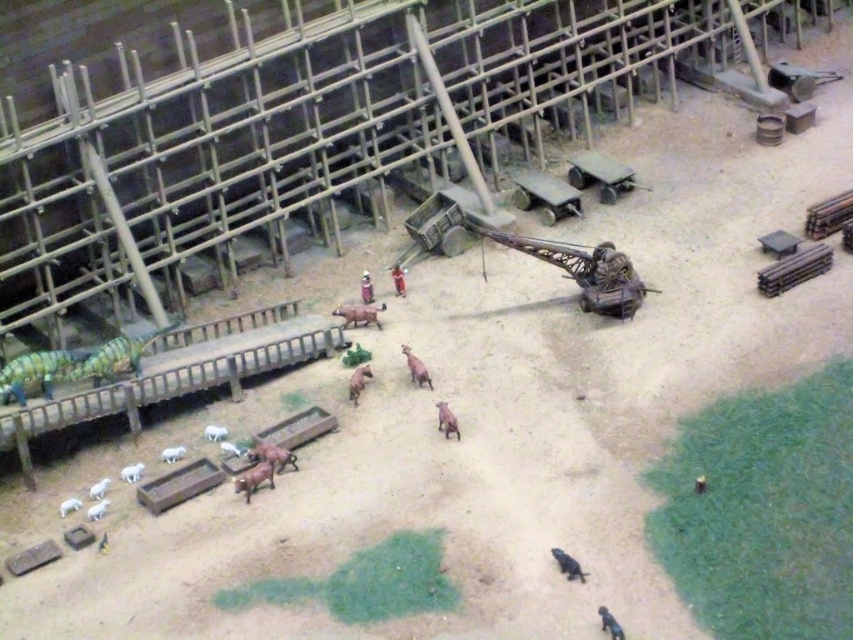
How distant is smooth plastic figure at center from smooth brown figure at center?

smooth plastic figure at center is 11.83 inches away from smooth brown figure at center.

Does smooth plastic figure at center appear under smooth brown figure at center?

Yes.

Between point (370, 300) and point (402, 285), which one is positioned behind?

The point (402, 285) is more distant.

Locate an element on the screen. This screenshot has width=853, height=640. smooth plastic figure at center is located at coordinates (366, 288).